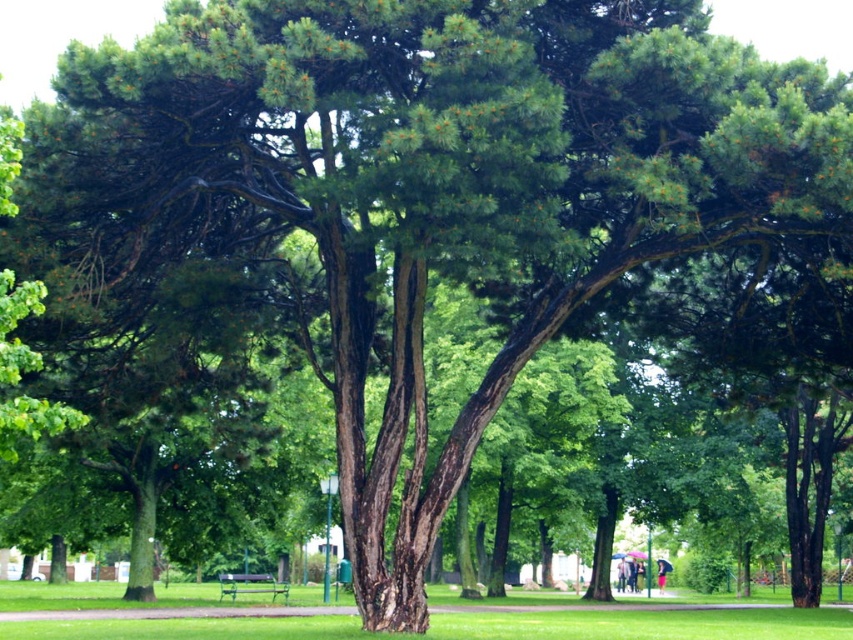
You are standing in the park and see two points marked on the ground. The first point is at coordinates point (49, 602) and the second is at point (274, 596). Which point is closer to you?

Point (49, 602) is in front of point (274, 596), so it is closer to you.

You are planning to place a picnic blanket on the green grass at center. There is a wooden park bench at center nearby. To ensure enough space for a picnic, you need at least 7 meters between the blanket and the bench. Is the current distance sufficient?

The green grass at center and wooden park bench at center are 7.16 meters apart, which is just enough to meet the requirement of at least 7 meters between them. Therefore, the current distance is sufficient for placing the picnic blanket.